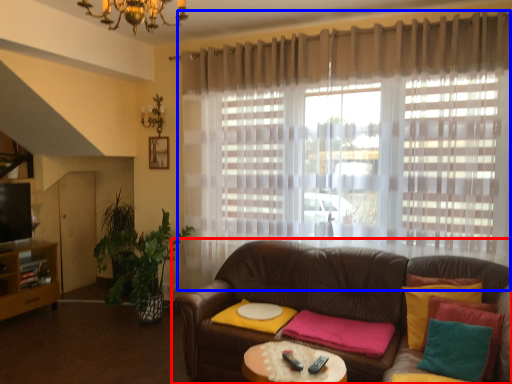
Question: Which of the following is the farthest to the observer, studio couch (highlighted by a red box) or curtain (highlighted by a blue box)?

Choices:
 (A) studio couch
 (B) curtain

Answer: (B)